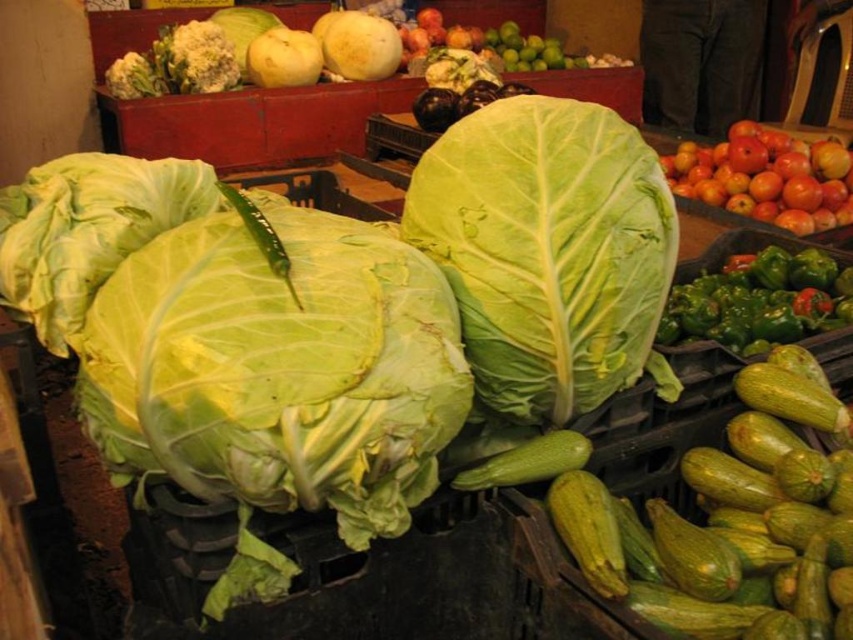
You are at a market stall and see the green leafy at center and the shiny red apples at upper right. Which one is positioned to the left?

The green leafy at center is positioned to the left of the shiny red apples at upper right.

You are a chef preparing a vegetable platter and need to choose between the green leafy cabbage at center and the green matte pepper at right. Which one is bigger?

The green leafy cabbage at center is bigger than the green matte pepper at right.